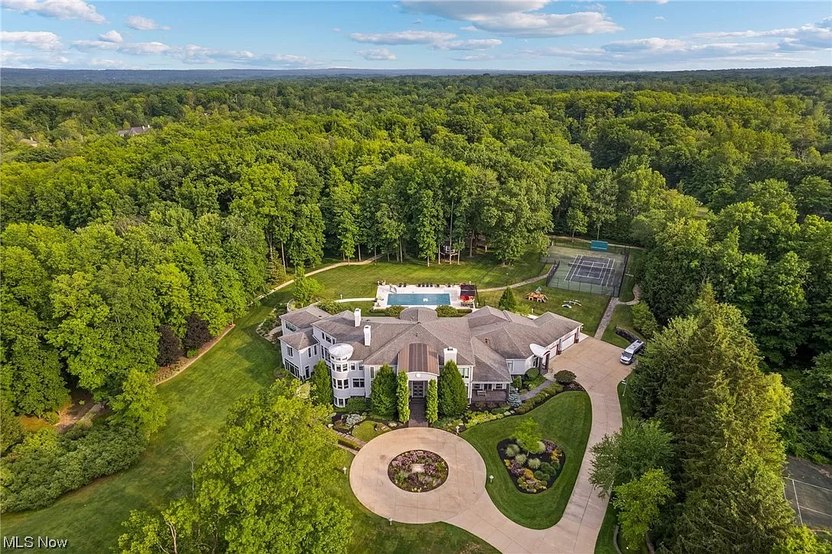
Locate an element on the screen. chair is located at coordinates (399, 284), (404, 284), (419, 284), (423, 284), (428, 284), (434, 284), (446, 283).